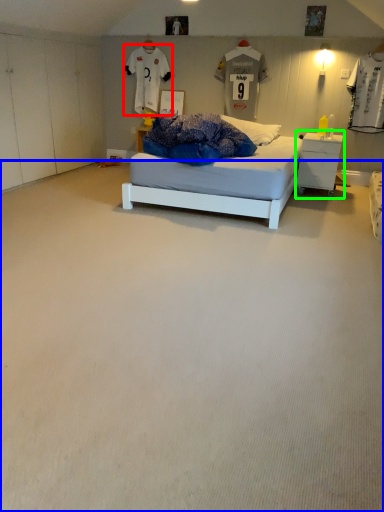
Question: Estimate the real-world distances between objects in this image. Which object is closer to t shirt (highlighted by a red box), plain (highlighted by a blue box) or nightstand (highlighted by a green box)?

Choices:
 (A) plain
 (B) nightstand

Answer: (B)